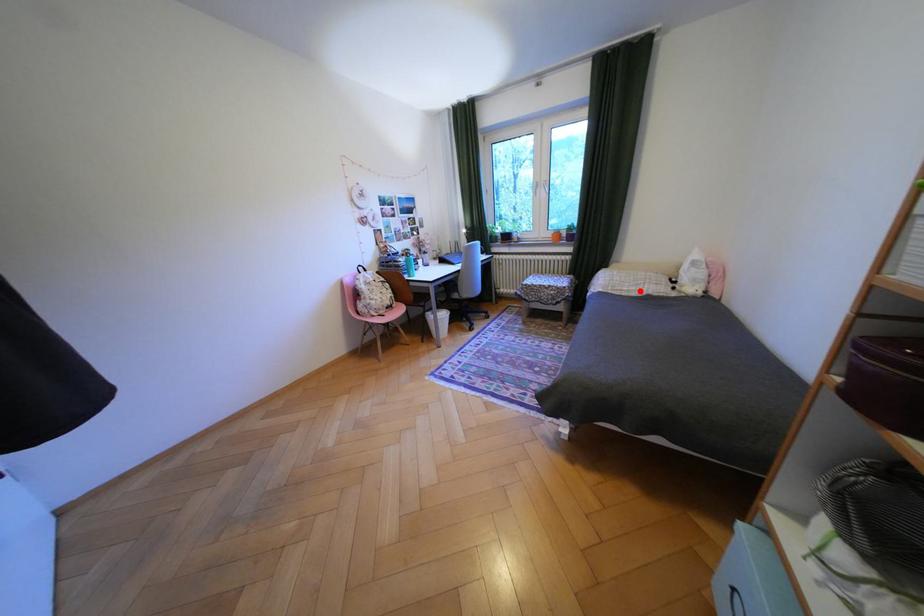
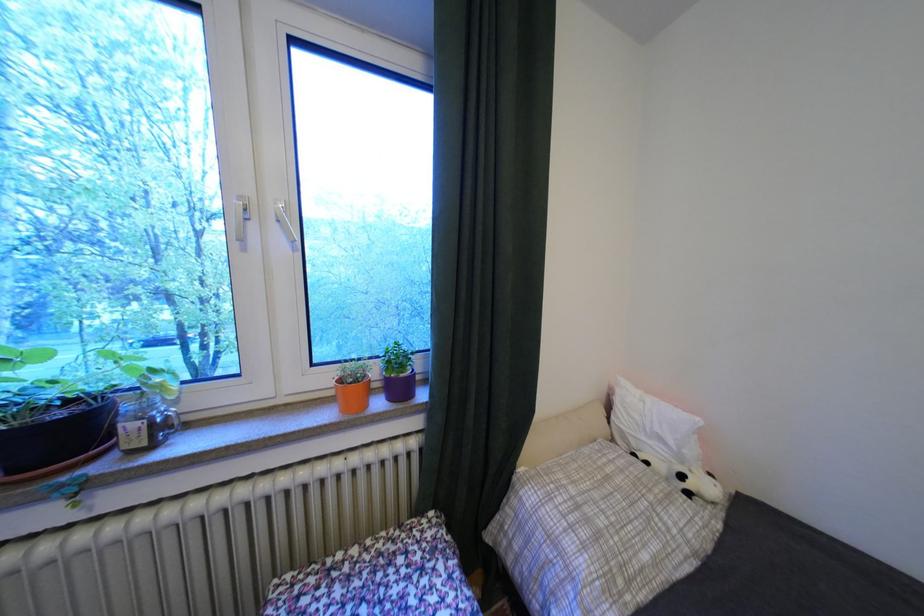
Locate, in the second image, the point that corresponds to the highlighted location in the first image.

(667, 562)